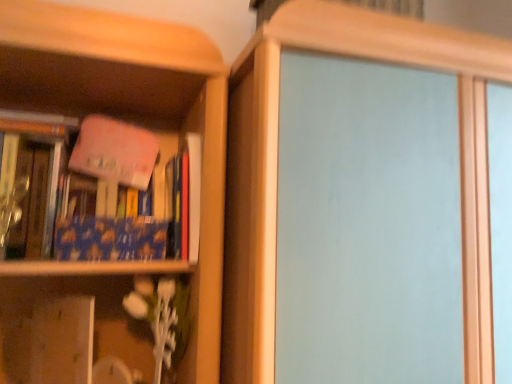
Locate an element on the screen. Image resolution: width=512 pixels, height=384 pixels. transparent glass screen door at center is located at coordinates (367, 224).

What are the coordinates of `blue matte book at left, which ranks as the 1th book in left-to-right order` in the screenshot? It's located at (28, 196).

Where is `transparent glass screen door at center`? This screenshot has height=384, width=512. transparent glass screen door at center is located at coordinates (367, 224).

Can you confirm if wooden vase at lower left is smaller than blue matte book at left, which is counted as the second book, starting from the right?

No.

Where is `shelf that appears in front of the blue matte book at left, which ranks as the 1th book in left-to-right order`? The image size is (512, 384). shelf that appears in front of the blue matte book at left, which ranks as the 1th book in left-to-right order is located at coordinates (69, 328).

Between wooden vase at lower left and blue matte book at left, which is counted as the second book, starting from the right, which one has less height?

wooden vase at lower left.

From a real-world perspective, is wooden vase at lower left physically located above or below blue matte book at left, which ranks as the 1th book in left-to-right order?

In terms of real-world spatial position, wooden vase at lower left is below blue matte book at left, which ranks as the 1th book in left-to-right order.

Is pink matte book at upper left, which is counted as the first book, starting from the right, wider or thinner than wooden vase at lower left?

Considering their sizes, pink matte book at upper left, which is counted as the first book, starting from the right, looks slimmer than wooden vase at lower left.

Is point (16, 174) closer or farther from the camera than point (72, 296)?

Point (16, 174).

Is pink matte book at upper left, which is counted as the second book, starting from the left, turned away from wooden vase at lower left?

No, pink matte book at upper left, which is counted as the second book, starting from the left, is not facing away from wooden vase at lower left.

Between pink matte book at upper left, which is counted as the first book, starting from the right, and wooden vase at lower left, which one has less height?

With less height is wooden vase at lower left.

Does wooden vase at lower left have a lesser width compared to pink matte book at upper left, which is counted as the first book, starting from the right?

No, wooden vase at lower left is not thinner than pink matte book at upper left, which is counted as the first book, starting from the right.

Which of these two, wooden vase at lower left or pink matte book at upper left, which is counted as the first book, starting from the right, is bigger?

wooden vase at lower left is bigger.

Visually, is wooden vase at lower left positioned to the left or to the right of pink matte book at upper left, which is counted as the second book, starting from the left?

wooden vase at lower left is to the left of pink matte book at upper left, which is counted as the second book, starting from the left.

Is pink matte book at upper left, which is counted as the second book, starting from the left, located within wooden vase at lower left?

Actually, pink matte book at upper left, which is counted as the second book, starting from the left, is outside wooden vase at lower left.

Would you say transparent glass screen door at center is to the left or to the right of blue matte book at left, which ranks as the 1th book in left-to-right order, in the picture?

Clearly, transparent glass screen door at center is on the right of blue matte book at left, which ranks as the 1th book in left-to-right order, in the image.

In the scene shown: How many degrees apart are the facing directions of transparent glass screen door at center and blue matte book at left, which ranks as the 1th book in left-to-right order?

The facing directions of transparent glass screen door at center and blue matte book at left, which ranks as the 1th book in left-to-right order, are 3.32 degrees apart.

From the image's perspective, who appears lower, transparent glass screen door at center or blue matte book at left, which ranks as the 1th book in left-to-right order?

transparent glass screen door at center.

From the picture: Is transparent glass screen door at center further to camera compared to blue matte book at left, which ranks as the 1th book in left-to-right order?

No, transparent glass screen door at center is closer to the viewer.

Does blue matte book at left, which is counted as the second book, starting from the right, have a smaller size compared to transparent glass screen door at center?

Yes, blue matte book at left, which is counted as the second book, starting from the right, is smaller than transparent glass screen door at center.

From the image's perspective, which is above, blue matte book at left, which ranks as the 1th book in left-to-right order, or transparent glass screen door at center?

blue matte book at left, which ranks as the 1th book in left-to-right order, appears higher in the image.

Can you tell me how much transparent glass screen door at center and pink matte book at upper left, which is counted as the first book, starting from the right, differ in facing direction?

transparent glass screen door at center and pink matte book at upper left, which is counted as the first book, starting from the right, are facing 3.32 degrees away from each other.

From the image's perspective, which is above, transparent glass screen door at center or pink matte book at upper left, which is counted as the first book, starting from the right?

pink matte book at upper left, which is counted as the first book, starting from the right.

Which is nearer, (383, 297) or (140, 150)?

Clearly, point (383, 297) is closer to the camera than point (140, 150).

Do you think transparent glass screen door at center is within pink matte book at upper left, which is counted as the first book, starting from the right, or outside of it?

transparent glass screen door at center is spatially situated outside pink matte book at upper left, which is counted as the first book, starting from the right.

Considering the positions of point (112, 173) and point (322, 85), is point (112, 173) closer or farther from the camera than point (322, 85)?

Point (112, 173) is farther from the camera than point (322, 85).

Is pink matte book at upper left, which is counted as the first book, starting from the right, far from transparent glass screen door at center?

No.

Could you tell me if pink matte book at upper left, which is counted as the first book, starting from the right, is turned towards transparent glass screen door at center?

No.

From a real-world perspective, starting from the transparent glass screen door at center, which book is the 2nd one vertically above it? Please provide its 2D coordinates.

[(111, 190)]

You are a GUI agent. You are given a task and a screenshot of the screen. Output one action in this format:
    pyautogui.click(x=<x>, y=<y>)
    Task: Click on the book that is the 1st one above the wooden vase at lower left (from a real-world perspective)
    
    Given the screenshot: What is the action you would take?
    pyautogui.click(x=28, y=196)

I want to click on book that is the 2nd one when counting upward from the wooden vase at lower left (from the image's perspective), so click(x=111, y=190).

Based on their spatial positions, is wooden vase at lower left or blue matte book at left, which is counted as the second book, starting from the right, closer to pink matte book at upper left, which is counted as the second book, starting from the left?

Based on the image, blue matte book at left, which is counted as the second book, starting from the right, appears to be nearer to pink matte book at upper left, which is counted as the second book, starting from the left.

Looking at the image, which one is located closer to wooden vase at lower left, blue matte book at left, which ranks as the 1th book in left-to-right order, or pink matte book at upper left, which is counted as the first book, starting from the right?

blue matte book at left, which ranks as the 1th book in left-to-right order, lies closer to wooden vase at lower left than the other object.

From the image, which object appears to be farther from wooden vase at lower left, pink matte book at upper left, which is counted as the second book, starting from the left, or blue matte book at left, which ranks as the 1th book in left-to-right order?

Among the two, pink matte book at upper left, which is counted as the second book, starting from the left, is located further to wooden vase at lower left.

From the image, which object appears to be farther from transparent glass screen door at center, pink matte book at upper left, which is counted as the second book, starting from the left, or wooden vase at lower left?

The object further to transparent glass screen door at center is wooden vase at lower left.

Looking at the image, which one is located closer to transparent glass screen door at center, blue matte book at left, which ranks as the 1th book in left-to-right order, or wooden vase at lower left?

wooden vase at lower left is closer to transparent glass screen door at center.

Estimate the real-world distances between objects in this image. Which object is closer to blue matte book at left, which is counted as the second book, starting from the right, wooden vase at lower left or transparent glass screen door at center?

wooden vase at lower left.

Based on the photo, considering their positions, is transparent glass screen door at center positioned further to pink matte book at upper left, which is counted as the second book, starting from the left, than blue matte book at left, which ranks as the 1th book in left-to-right order?

Among the two, transparent glass screen door at center is located further to pink matte book at upper left, which is counted as the second book, starting from the left.

Looking at the image, which one is located further to pink matte book at upper left, which is counted as the second book, starting from the left, transparent glass screen door at center or wooden vase at lower left?

transparent glass screen door at center is further to pink matte book at upper left, which is counted as the second book, starting from the left.

Where is `book located between wooden vase at lower left and transparent glass screen door at center in the left-right direction`? The height and width of the screenshot is (384, 512). book located between wooden vase at lower left and transparent glass screen door at center in the left-right direction is located at coordinates (111, 190).

The height and width of the screenshot is (384, 512). In order to click on shelf between blue matte book at left, which ranks as the 1th book in left-to-right order, and transparent glass screen door at center, in the horizontal direction in this screenshot , I will do `click(69, 328)`.

At what (x,y) coordinates should I click in order to perform the action: click on book between pink matte book at upper left, which is counted as the first book, starting from the right, and wooden vase at lower left, in the vertical direction. Please return your answer as a coordinate pair (x, y). The height and width of the screenshot is (384, 512). Looking at the image, I should click on (28, 196).

Identify the location of book between blue matte book at left, which is counted as the second book, starting from the right, and transparent glass screen door at center. (111, 190).